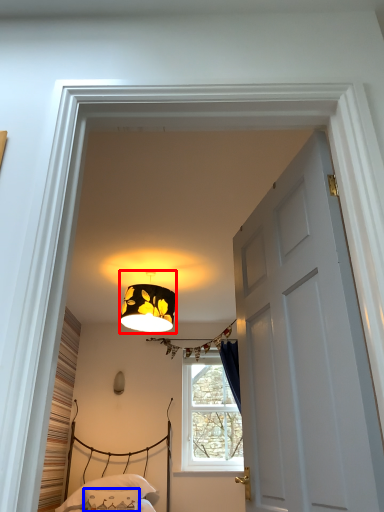
Question: Which of the following is the closest to the observer, lamp (highlighted by a red box) or pillow (highlighted by a blue box)?

Choices:
 (A) lamp
 (B) pillow

Answer: (A)